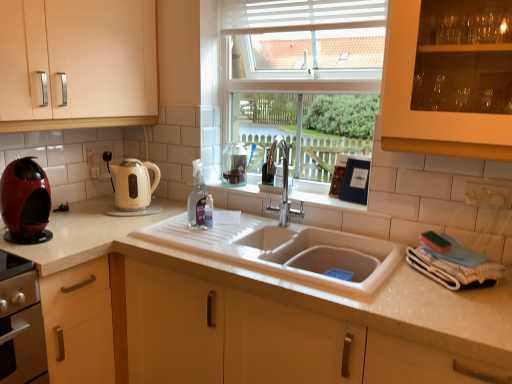
Question: From the image's perspective, is shiny red coffee machine at left, acting as the second kitchen appliance starting from the back, over matte cream cabinet at left?

Choices:
 (A) yes
 (B) no

Answer: (B)

Question: Could you tell me if shiny red coffee machine at left, which is the 2th kitchen appliance in right-to-left order, is turned towards matte cream cabinet at left?

Choices:
 (A) no
 (B) yes

Answer: (A)

Question: Is matte cream cabinet at left located within shiny red coffee machine at left, acting as the second kitchen appliance starting from the back?

Choices:
 (A) no
 (B) yes

Answer: (A)

Question: Does shiny red coffee machine at left, which appears as the first kitchen appliance when viewed from the left, lie behind matte cream cabinet at left?

Choices:
 (A) no
 (B) yes

Answer: (B)

Question: Is shiny red coffee machine at left, which is the 2th kitchen appliance in right-to-left order, shorter than matte cream cabinet at left?

Choices:
 (A) yes
 (B) no

Answer: (A)

Question: Looking at the image, does cream matte electric kettle at left, the second kitchen appliance from the left, seem bigger or smaller compared to clear glass spray bottle at center?

Choices:
 (A) big
 (B) small

Answer: (A)

Question: From a real-world perspective, is cream matte electric kettle at left, positioned as the first kitchen appliance in right-to-left order, above or below clear glass spray bottle at center?

Choices:
 (A) above
 (B) below

Answer: (B)

Question: From the image's perspective, relative to clear glass spray bottle at center, is cream matte electric kettle at left, positioned as the first kitchen appliance in right-to-left order, above or below?

Choices:
 (A) below
 (B) above

Answer: (B)

Question: In the image, is cream matte electric kettle at left, the second kitchen appliance from the left, on the left side or the right side of clear glass spray bottle at center?

Choices:
 (A) right
 (B) left

Answer: (B)

Question: In terms of height, does white glossy countertop at center look taller or shorter compared to cream matte electric kettle at left, the second kitchen appliance from the left?

Choices:
 (A) tall
 (B) short

Answer: (A)

Question: Is white glossy countertop at center wider or thinner than cream matte electric kettle at left, which is the 1th kitchen appliance from back to front?

Choices:
 (A) thin
 (B) wide

Answer: (B)

Question: Considering the positions of white glossy countertop at center and cream matte electric kettle at left, which is the 2th kitchen appliance in front-to-back order, in the image, is white glossy countertop at center bigger or smaller than cream matte electric kettle at left, which is the 2th kitchen appliance in front-to-back order,?

Choices:
 (A) big
 (B) small

Answer: (A)

Question: Visually, is white glossy countertop at center positioned to the left or to the right of cream matte electric kettle at left, the second kitchen appliance from the left?

Choices:
 (A) right
 (B) left

Answer: (A)

Question: Considering their positions, is matte cream cabinet at left located in front of or behind cream matte electric kettle at left, positioned as the first kitchen appliance in right-to-left order?

Choices:
 (A) front
 (B) behind

Answer: (A)

Question: Is matte cream cabinet at left to the left or to the right of cream matte electric kettle at left, which is the 1th kitchen appliance from back to front, in the image?

Choices:
 (A) right
 (B) left

Answer: (B)